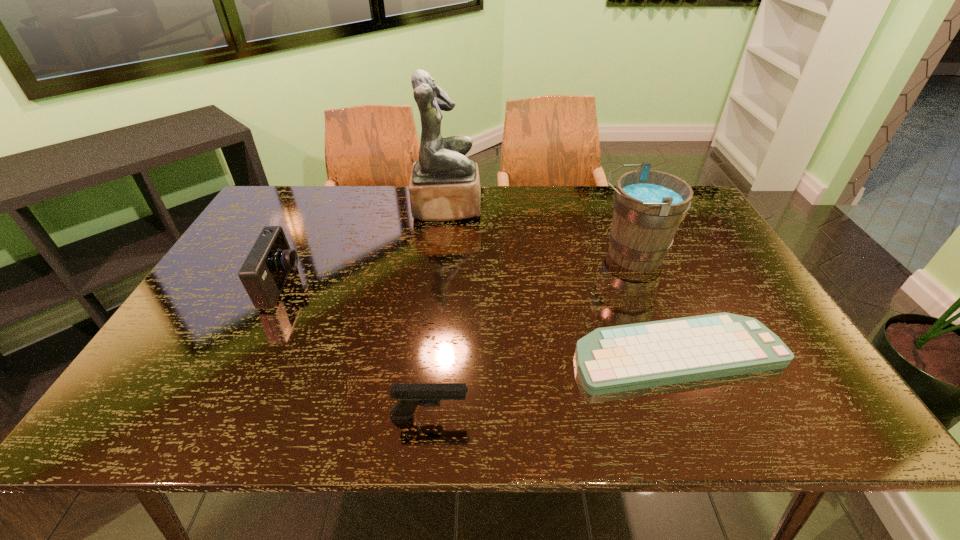
The width and height of the screenshot is (960, 540). What are the coordinates of `object at the right edge` in the screenshot? It's located at (620, 358).

Find the location of a particular element. The height and width of the screenshot is (540, 960). object that is at the near right corner is located at coordinates (620, 358).

Where is `vacant space at the far edge of the desktop`? This screenshot has width=960, height=540. vacant space at the far edge of the desktop is located at coordinates (606, 220).

Locate an element on the screen. The height and width of the screenshot is (540, 960). free spot at the near edge of the desktop is located at coordinates (564, 415).

Find the location of `free space at the left edge of the desktop`. free space at the left edge of the desktop is located at coordinates (188, 319).

The image size is (960, 540). Identify the location of vacant space at the right edge of the desktop. (745, 302).

Image resolution: width=960 pixels, height=540 pixels. I want to click on free spot at the far left corner of the desktop, so click(297, 214).

In the image, there is a desktop. What are the coordinates of `free space at the near left corner` in the screenshot? It's located at (162, 421).

Identify the location of vacant region between the leftmost object and the shortest object. The height and width of the screenshot is (540, 960). (480, 320).

This screenshot has width=960, height=540. I want to click on free space between the second tallest object and the fourth farthest object, so click(x=655, y=305).